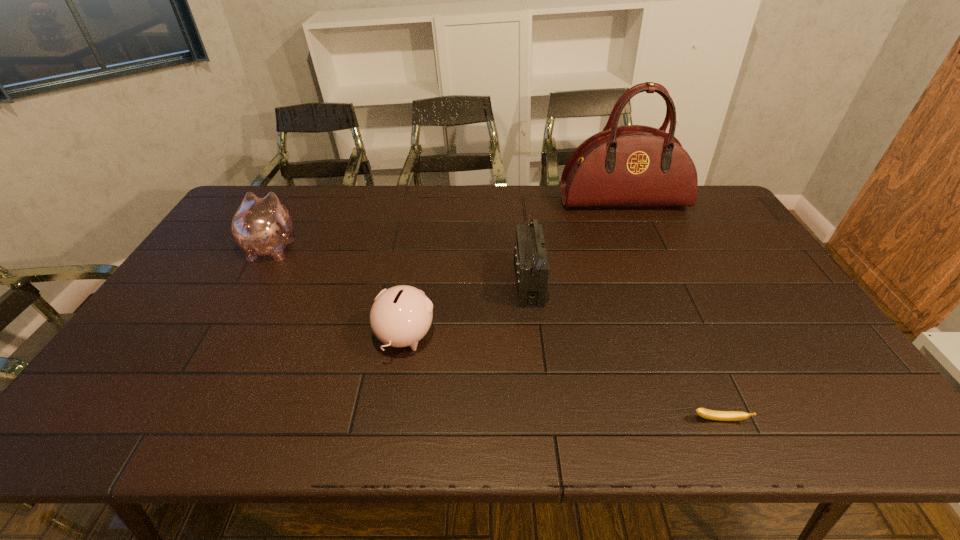
In order to click on object located in the left edge section of the desktop in this screenshot , I will do `click(261, 226)`.

Locate an element on the screen. object at the right edge is located at coordinates (634, 165).

Image resolution: width=960 pixels, height=540 pixels. I want to click on object that is at the far right corner, so click(x=634, y=165).

Identify the location of vacant space at the far edge of the desktop. (338, 207).

Locate an element on the screen. The image size is (960, 540). free point at the near edge is located at coordinates [x=412, y=434].

Image resolution: width=960 pixels, height=540 pixels. Find the location of `vacant area at the right edge of the desktop`. vacant area at the right edge of the desktop is located at coordinates (738, 286).

In order to click on vacant space at the near right corner of the desktop in this screenshot , I will do `click(823, 428)`.

What are the coordinates of `vacant space that is in between the farther piggy bank and the second tallest object` in the screenshot? It's located at (400, 266).

Where is `vacant space in between the farthest object and the nearest object`? The height and width of the screenshot is (540, 960). vacant space in between the farthest object and the nearest object is located at coordinates (671, 310).

Identify the location of free space between the third object from right to left and the right piggy bank. The image size is (960, 540). (467, 310).